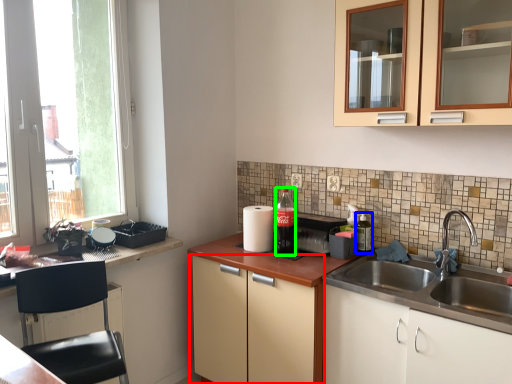
Question: Which object is positioned closest to cabinetry (highlighted by a red box)? Select from bottle (highlighted by a blue box) and bottle (highlighted by a green box).

Choices:
 (A) bottle
 (B) bottle

Answer: (B)